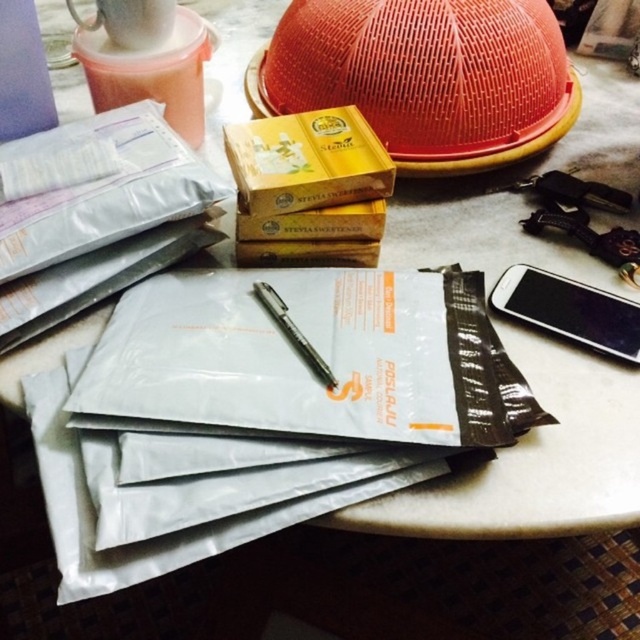
From the picture: Can you confirm if black glossy smartphone at right is positioned to the right of black metallic pen at center?

Correct, you'll find black glossy smartphone at right to the right of black metallic pen at center.

Who is shorter, black glossy smartphone at right or black metallic pen at center?

black metallic pen at center is shorter.

Locate an element on the screen. The image size is (640, 640). black glossy smartphone at right is located at coordinates (570, 308).